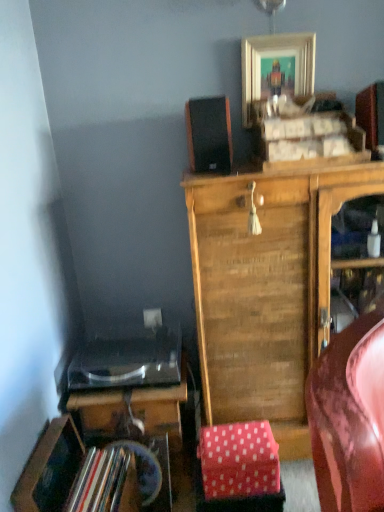
What do you see at coordinates (209, 135) in the screenshot? I see `black matte speaker at upper center` at bounding box center [209, 135].

Locate an element on the screen. wooden cabinet at center is located at coordinates (266, 289).

The image size is (384, 512). I want to click on stool beneath the black matte speaker at upper center (from a real-world perspective), so click(x=239, y=469).

Who is shorter, black matte speaker at upper center or pink polka dot fabric at lower center?

Standing shorter between the two is pink polka dot fabric at lower center.

From the image's perspective, between black matte speaker at upper center and pink polka dot fabric at lower center, which one is located above?

black matte speaker at upper center appears higher in the image.

Considering the relative sizes of shiny black desk at lower left and pink polka dot fabric at lower center in the image provided, is shiny black desk at lower left wider than pink polka dot fabric at lower center?

Yes.

Between point (166, 417) and point (212, 489), which one is positioned in front?

The point (212, 489) is closer.

From a real-world perspective, relative to pink polka dot fabric at lower center, is shiny black desk at lower left vertically above or below?

shiny black desk at lower left is above pink polka dot fabric at lower center.

Is gold metallic picture frame at upper center facing away from black matte speaker at upper center?

No, gold metallic picture frame at upper center is not facing away from black matte speaker at upper center.

Does point (312, 44) lie behind point (229, 156)?

Yes, point (312, 44) is farther from viewer.

Does gold metallic picture frame at upper center have a greater width compared to black matte speaker at upper center?

Incorrect, the width of gold metallic picture frame at upper center does not surpass that of black matte speaker at upper center.

Is the depth of gold metallic picture frame at upper center greater than that of black matte speaker at upper center?

Yes, gold metallic picture frame at upper center is behind black matte speaker at upper center.

Is pink polka dot fabric at lower center further to the viewer compared to wooden cabinet at center?

Yes, pink polka dot fabric at lower center is further from the viewer.

Between pink polka dot fabric at lower center and wooden cabinet at center, which one has larger size?

wooden cabinet at center is bigger.

In order to click on stool that appears on the left of wooden cabinet at center in this screenshot , I will do `click(239, 469)`.

Between point (170, 449) and point (285, 61), which one is positioned behind?

The point (285, 61) is farther.

Can you confirm if shiny black desk at lower left is positioned to the right of gold metallic picture frame at upper center?

No.

Is shiny black desk at lower left aimed at gold metallic picture frame at upper center?

No, shiny black desk at lower left is not facing towards gold metallic picture frame at upper center.

From the image's perspective, is shiny black desk at lower left on gold metallic picture frame at upper center?

No, from the image's perspective, shiny black desk at lower left is not on top of gold metallic picture frame at upper center.

Which of these two, gold metallic picture frame at upper center or wooden cabinet at center, stands taller?

With more height is wooden cabinet at center.

Could you tell me if gold metallic picture frame at upper center is facing wooden cabinet at center?

No, gold metallic picture frame at upper center is not oriented towards wooden cabinet at center.

Considering the positions of objects gold metallic picture frame at upper center and wooden cabinet at center in the image provided, who is behind, gold metallic picture frame at upper center or wooden cabinet at center?

Positioned behind is gold metallic picture frame at upper center.

Is gold metallic picture frame at upper center beside wooden cabinet at center?

gold metallic picture frame at upper center is not next to wooden cabinet at center, and they're not touching.

The height and width of the screenshot is (512, 384). In order to click on picture frame behind the shiny black desk at lower left in this screenshot , I will do coord(276,68).

Who is bigger, gold metallic picture frame at upper center or shiny black desk at lower left?

shiny black desk at lower left.

Which is in front, point (278, 71) or point (83, 420)?

Point (83, 420)

At what (x,y) coordinates should I click in order to perform the action: click on speaker behind the pink polka dot fabric at lower center. Please return your answer as a coordinate pair (x, y). This screenshot has width=384, height=512. Looking at the image, I should click on (209, 135).

I want to click on desk lying on the left of pink polka dot fabric at lower center, so click(132, 414).

Estimate the real-world distances between objects in this image. Which object is closer to wooden cabinet at center, gold metallic picture frame at upper center or shiny black desk at lower left?

shiny black desk at lower left.

Looking at the image, which one is located further to wooden cabinet at center, gold metallic picture frame at upper center or black matte speaker at upper center?

The object further to wooden cabinet at center is gold metallic picture frame at upper center.

Based on their spatial positions, is shiny black desk at lower left or gold metallic picture frame at upper center closer to wooden cabinet at center?

shiny black desk at lower left is positioned closer to the anchor wooden cabinet at center.

From the image, which object appears to be farther from shiny black desk at lower left, gold metallic picture frame at upper center or wooden cabinet at center?

gold metallic picture frame at upper center lies further to shiny black desk at lower left than the other object.

When comparing their distances from pink polka dot fabric at lower center, does wooden cabinet at center or shiny black desk at lower left seem further?

Among the two, wooden cabinet at center is located further to pink polka dot fabric at lower center.

Considering their positions, is shiny black desk at lower left positioned further to gold metallic picture frame at upper center than pink polka dot fabric at lower center?

pink polka dot fabric at lower center.

Based on their spatial positions, is black matte speaker at upper center or gold metallic picture frame at upper center closer to shiny black desk at lower left?

Based on the image, black matte speaker at upper center appears to be nearer to shiny black desk at lower left.

When comparing their distances from black matte speaker at upper center, does wooden cabinet at center or pink polka dot fabric at lower center seem closer?

wooden cabinet at center.

The width and height of the screenshot is (384, 512). Find the location of `speaker between gold metallic picture frame at upper center and pink polka dot fabric at lower center in the vertical direction`. speaker between gold metallic picture frame at upper center and pink polka dot fabric at lower center in the vertical direction is located at coordinates (209, 135).

This screenshot has height=512, width=384. What are the coordinates of `cabinetry between black matte speaker at upper center and pink polka dot fabric at lower center vertically` in the screenshot? It's located at (266, 289).

At what (x,y) coordinates should I click in order to perform the action: click on cabinetry between gold metallic picture frame at upper center and shiny black desk at lower left in the vertical direction. Please return your answer as a coordinate pair (x, y). This screenshot has height=512, width=384. Looking at the image, I should click on (266, 289).

Identify the location of speaker between gold metallic picture frame at upper center and shiny black desk at lower left in the vertical direction. (209, 135).